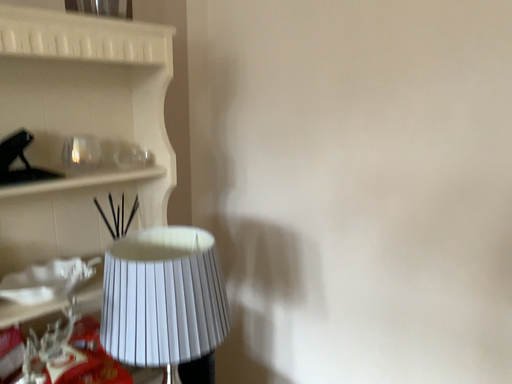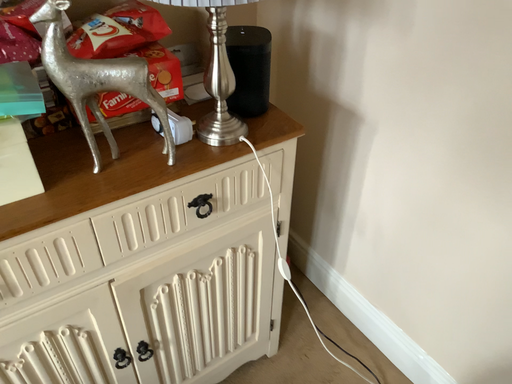
Question: Which way did the camera rotate in the video?

Choices:
 (A) rotated downward
 (B) rotated upward

Answer: (A)